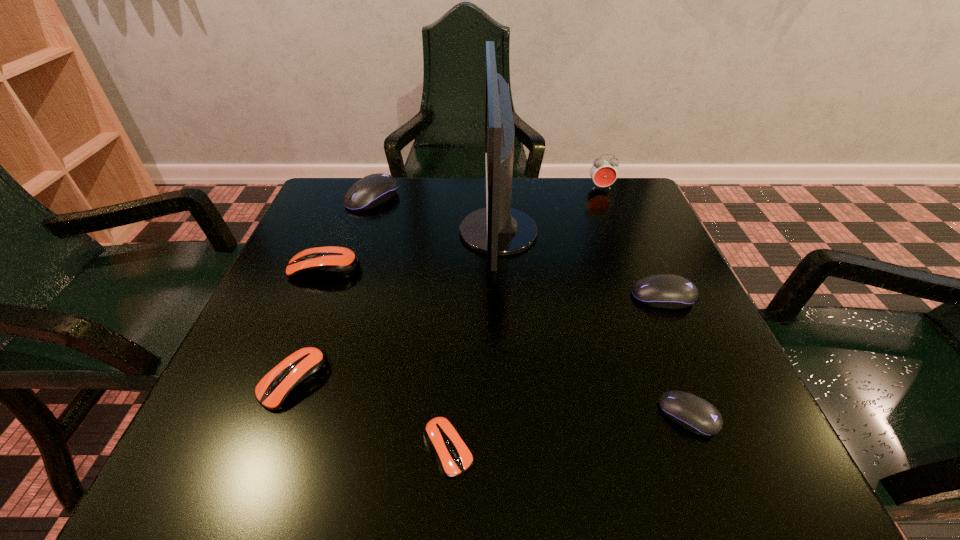
Identify the location of vacant space at the far edge of the desktop. This screenshot has width=960, height=540. (386, 227).

Identify the location of free space at the near edge of the desktop. This screenshot has width=960, height=540. (378, 456).

Where is `vacant region at the left edge of the desktop`? The height and width of the screenshot is (540, 960). vacant region at the left edge of the desktop is located at coordinates (363, 242).

Locate an element on the screen. The width and height of the screenshot is (960, 540). vacant space at the right edge is located at coordinates (631, 236).

In the image, there is a desktop. Where is `free space at the far right corner`? The width and height of the screenshot is (960, 540). free space at the far right corner is located at coordinates (597, 220).

The height and width of the screenshot is (540, 960). Find the location of `free space between the nearest black computer mouse and the biggest orange computer mouse`. free space between the nearest black computer mouse and the biggest orange computer mouse is located at coordinates (507, 342).

Where is `free area in between the seventh shortest object and the second smallest orange computer mouse`? The height and width of the screenshot is (540, 960). free area in between the seventh shortest object and the second smallest orange computer mouse is located at coordinates (447, 285).

Find the location of `free area in between the shortest computer mouse and the red alarm clock`. free area in between the shortest computer mouse and the red alarm clock is located at coordinates (524, 318).

You are a GUI agent. You are given a task and a screenshot of the screen. Output one action in this format:
    pyautogui.click(x=<x>, y=<y>)
    Task: Click on the unoccupied area between the farthest orange computer mouse and the tallest object
    This screenshot has width=960, height=540.
    Given the screenshot: What is the action you would take?
    pyautogui.click(x=412, y=251)

Identify which object is the seventh closest to the second biggest orange computer mouse. Please provide its 2D coordinates. Your answer should be formatted as a tuple, i.e. [(x, y)], where the tuple contains the x and y coordinates of a point satisfying the conditions above.

[(603, 173)]